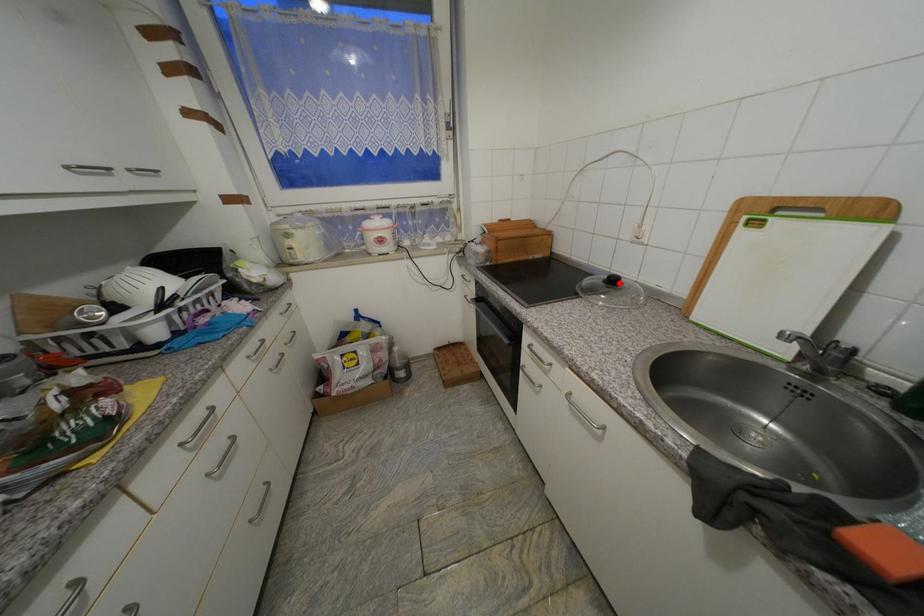
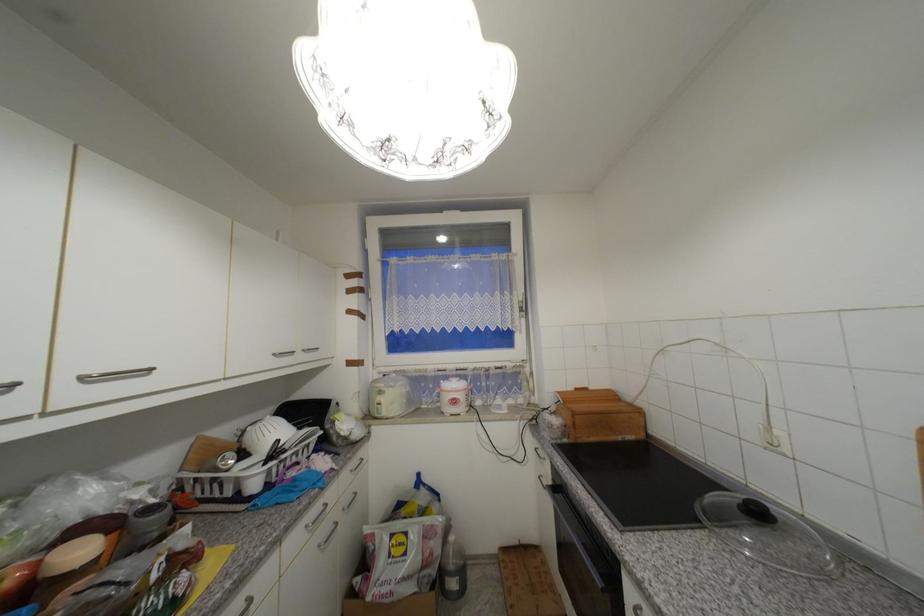
The point at the highlighted location is marked in the first image. Where is the corresponding point in the second image?

(763, 514)